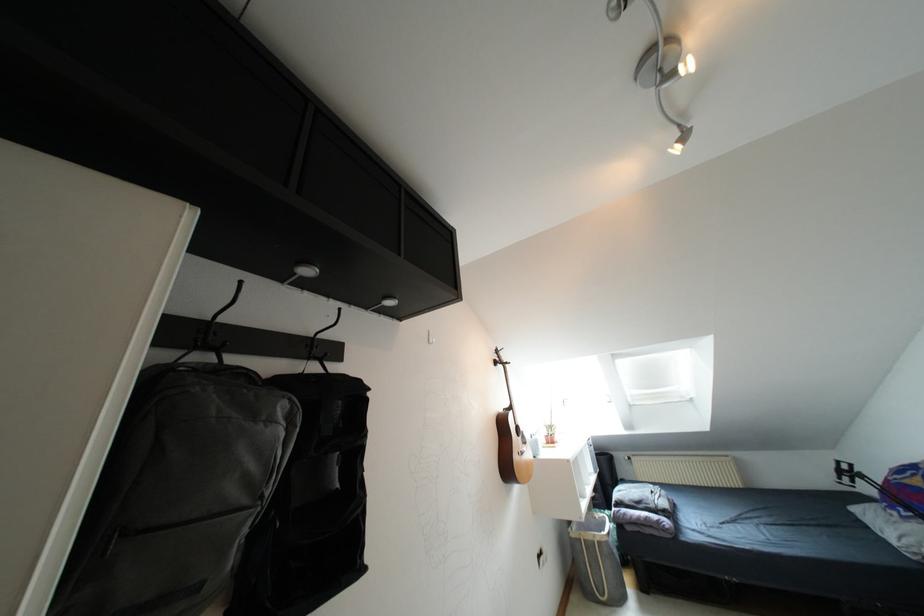
The height and width of the screenshot is (616, 924). What are the coordinates of `white wall hook` in the screenshot? It's located at (430, 338).